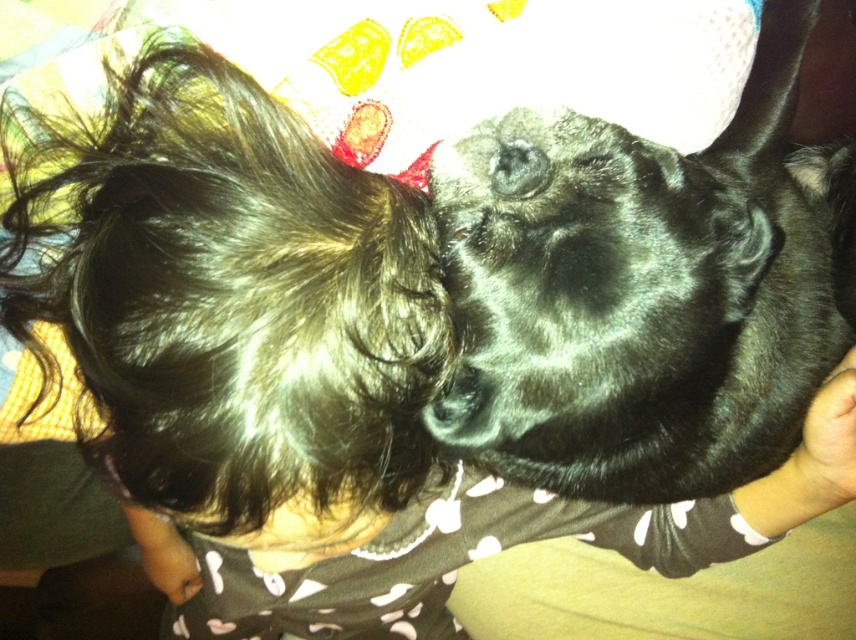
You are a photographer trying to capture a candid shot of the child and the dog. The camera you are using has a limited depth of field, so you can only focus on one object at a time. Based on their positions, which object should you choose to focus on to ensure the subject you want is in focus, considering the shiny dark brown hair at upper left and the black fur dog at center?

The shiny dark brown hair at upper left has a lesser height compared to the black fur dog at center. Since the dog is closer to the camera, focusing on the black fur dog at center will keep it in focus while the hair may blur slightly, but if focusing on the hair, the dog might be out of focus. Choose the dog to prioritize the main subject.

You are a photographer trying to capture the child and dog interaction. You notice the shiny dark brown hair at upper left and the black fur nose at center. Which object is nearer to your camera lens?

The shiny dark brown hair at upper left is closer to the viewer than the black fur nose at center, so it is nearer to the camera lens.